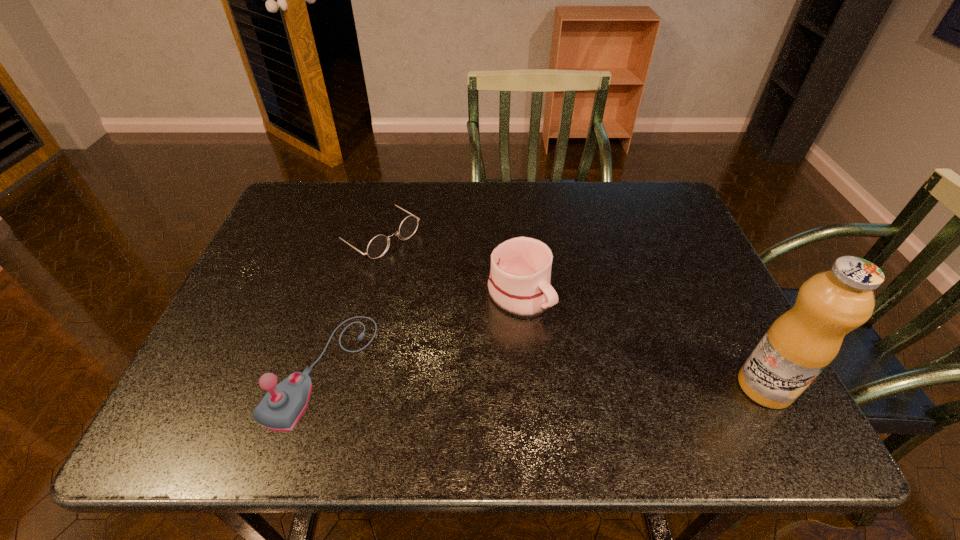
Locate an element on the screen. This screenshot has height=540, width=960. object present at the near left corner is located at coordinates (281, 408).

Locate an element on the screen. object located in the near right corner section of the desktop is located at coordinates pyautogui.click(x=802, y=342).

You are a GUI agent. You are given a task and a screenshot of the screen. Output one action in this format:
    pyautogui.click(x=<x>, y=<y>)
    Task: Click on the vacant region at the far edge of the desktop
    
    Given the screenshot: What is the action you would take?
    pyautogui.click(x=619, y=227)

Image resolution: width=960 pixels, height=540 pixels. What are the coordinates of `free space at the near edge of the desktop` in the screenshot? It's located at (482, 393).

You are a GUI agent. You are given a task and a screenshot of the screen. Output one action in this format:
    pyautogui.click(x=<x>, y=<y>)
    Task: Click on the free space at the left edge
    
    Given the screenshot: What is the action you would take?
    pyautogui.click(x=279, y=334)

Image resolution: width=960 pixels, height=540 pixels. I want to click on free region at the right edge of the desktop, so click(646, 252).

You are a GUI agent. You are given a task and a screenshot of the screen. Output one action in this format:
    pyautogui.click(x=<x>, y=<y>)
    Task: Click on the free area in between the joystick and the farthest object
    The image size is (960, 540).
    Given the screenshot: What is the action you would take?
    pyautogui.click(x=348, y=301)

Image resolution: width=960 pixels, height=540 pixels. Find the location of `empty space between the tallest object and the mug`. empty space between the tallest object and the mug is located at coordinates (642, 340).

Image resolution: width=960 pixels, height=540 pixels. Identify the location of vacant space in between the farthest object and the joystick. (348, 301).

Locate an element on the screen. free spot between the joystick and the second object from right to left is located at coordinates (420, 332).